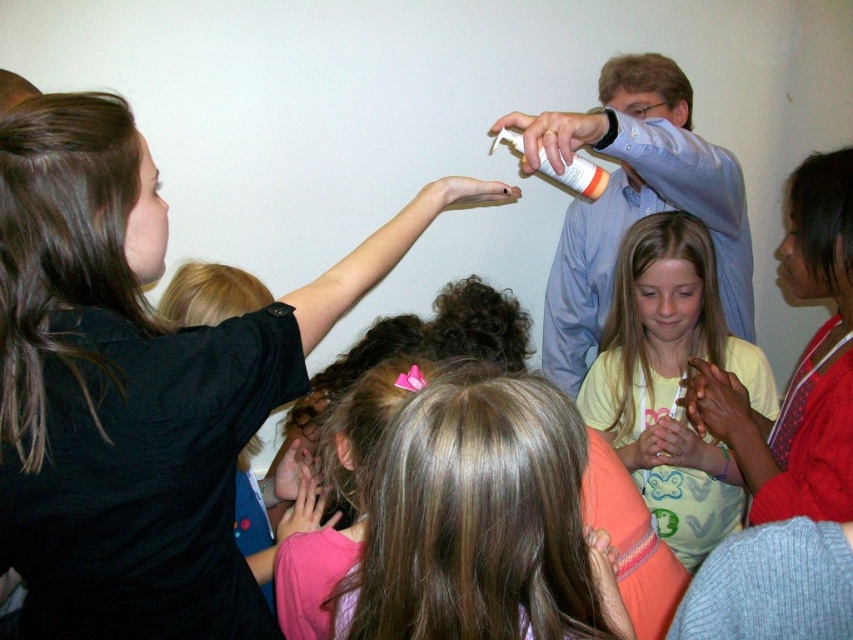
Question: Which of the following is the closest to the observer?

Choices:
 (A) (498, 138)
 (B) (839, 403)
 (C) (579, 589)

Answer: (C)

Question: Does yellow cotton shirt at center appear over matte red shirt at center?

Choices:
 (A) no
 (B) yes

Answer: (A)

Question: Which of these objects is positioned closest to the black matte shirt at upper left?

Choices:
 (A) blonde hair at center
 (B) matte red shirt at center
 (C) white plastic bottle at upper center

Answer: (A)

Question: Among these points, which one is farthest from the camera?

Choices:
 (A) (577, 176)
 (B) (786, 269)

Answer: (B)

Question: From the image, what is the correct spatial relationship of blonde hair at center in relation to yellow cotton shirt at center?

Choices:
 (A) right
 (B) left

Answer: (B)

Question: Does black matte shirt at upper left appear under matte red shirt at center?

Choices:
 (A) yes
 (B) no

Answer: (A)